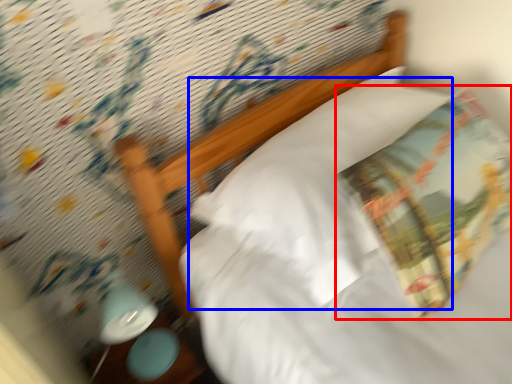
Question: Which point is closer to the camera, throw pillow (highlighted by a red box) or pillow (highlighted by a blue box)?

Choices:
 (A) throw pillow
 (B) pillow

Answer: (A)